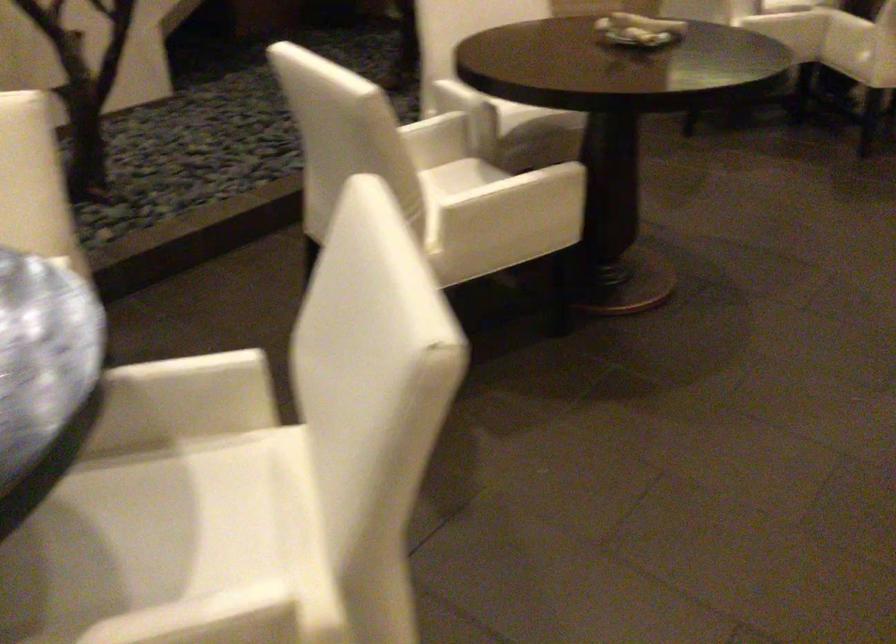
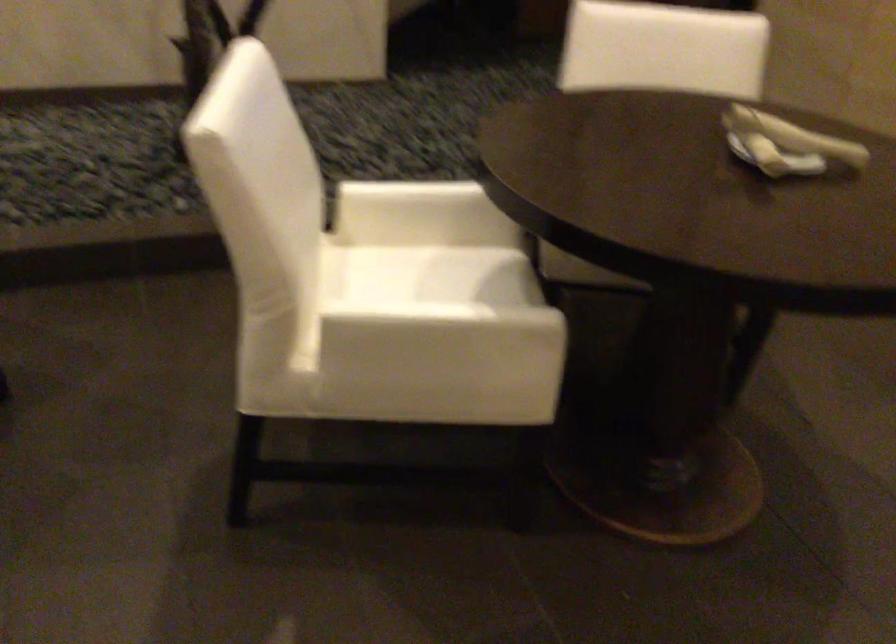
Find the pixel in the second image that matches pixel 424 180 in the first image.

(412, 261)